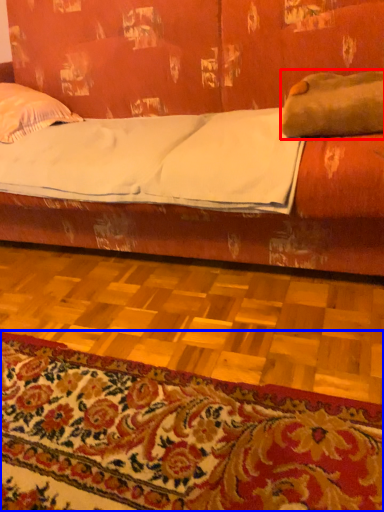
Question: Which point is further to the camera, pillow (highlighted by a red box) or mat (highlighted by a blue box)?

Choices:
 (A) pillow
 (B) mat

Answer: (A)